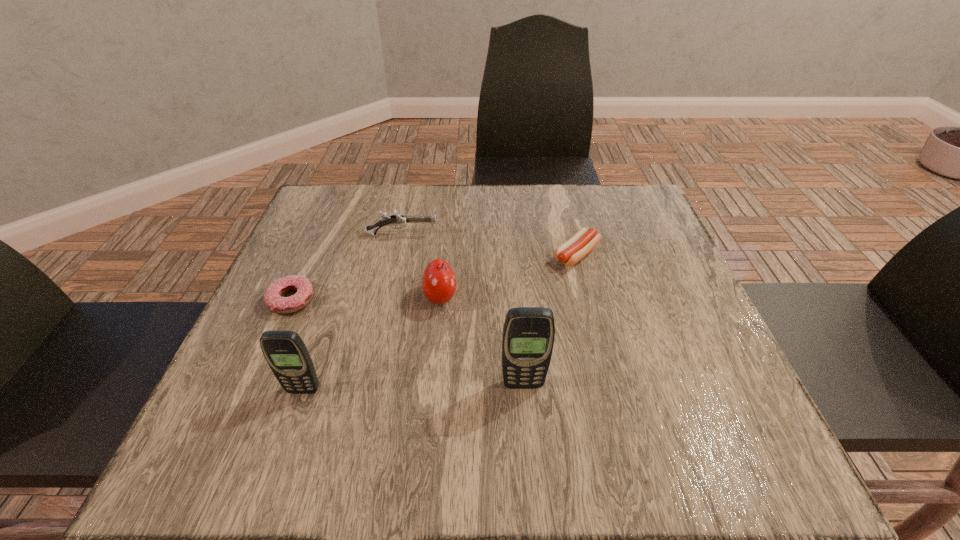
The height and width of the screenshot is (540, 960). I want to click on the left cellular telephone, so click(x=285, y=352).

The height and width of the screenshot is (540, 960). I want to click on the fifth shortest object, so click(285, 352).

Where is `the fifth object from left to right`? the fifth object from left to right is located at coordinates (528, 336).

The width and height of the screenshot is (960, 540). Find the location of `the taller cellular telephone`. the taller cellular telephone is located at coordinates (528, 336).

This screenshot has width=960, height=540. I want to click on gun, so pos(398,219).

Where is `the farthest object`? The width and height of the screenshot is (960, 540). the farthest object is located at coordinates (398, 219).

Find the location of `sausage`. sausage is located at coordinates (580, 244).

At what (x,y) coordinates should I click in order to perform the action: click on the rightmost object. Please return your answer as a coordinate pair (x, y). This screenshot has width=960, height=540. Looking at the image, I should click on (580, 244).

The width and height of the screenshot is (960, 540). Find the location of `doughnut`. doughnut is located at coordinates (273, 298).

Identify the location of the shortest object. (273, 298).